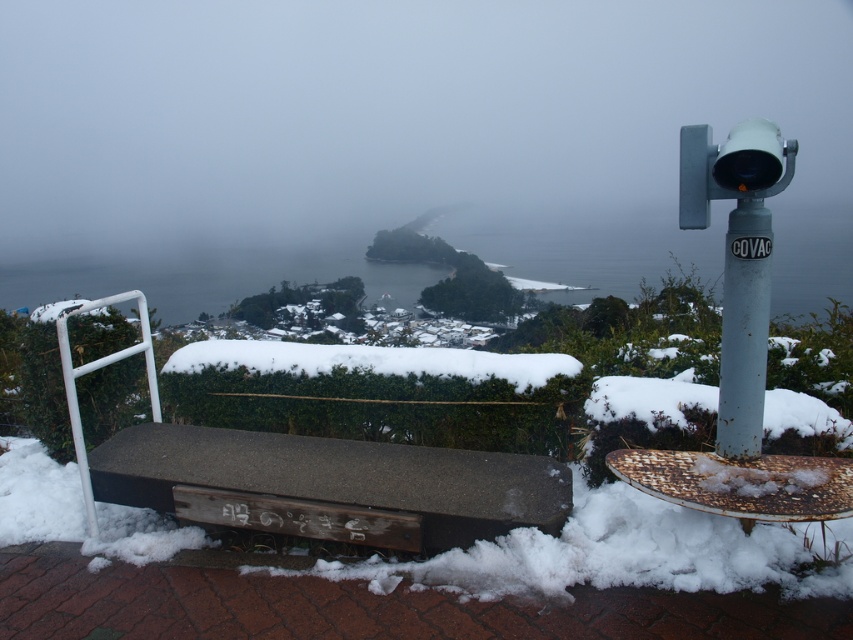
Question: Considering the real-world distances, which object is farthest from the rusty metal telescope at upper right?

Choices:
 (A) white fluffy hedge at center
 (B) wooden bench at center

Answer: (A)

Question: Is white fluffy hedge at center in front of rusty metal telescope at upper right?

Choices:
 (A) no
 (B) yes

Answer: (A)

Question: Can you confirm if wooden bench at center is thinner than rusty metal telescope at upper right?

Choices:
 (A) no
 (B) yes

Answer: (A)

Question: Which object is positioned farthest from the wooden bench at center?

Choices:
 (A) rusty metal telescope at upper right
 (B) white fluffy hedge at center

Answer: (A)

Question: Which point is farther from the camera taking this photo?

Choices:
 (A) pos(251,372)
 (B) pos(341,516)

Answer: (A)

Question: Does wooden bench at center have a smaller size compared to rusty metal telescope at upper right?

Choices:
 (A) no
 (B) yes

Answer: (A)